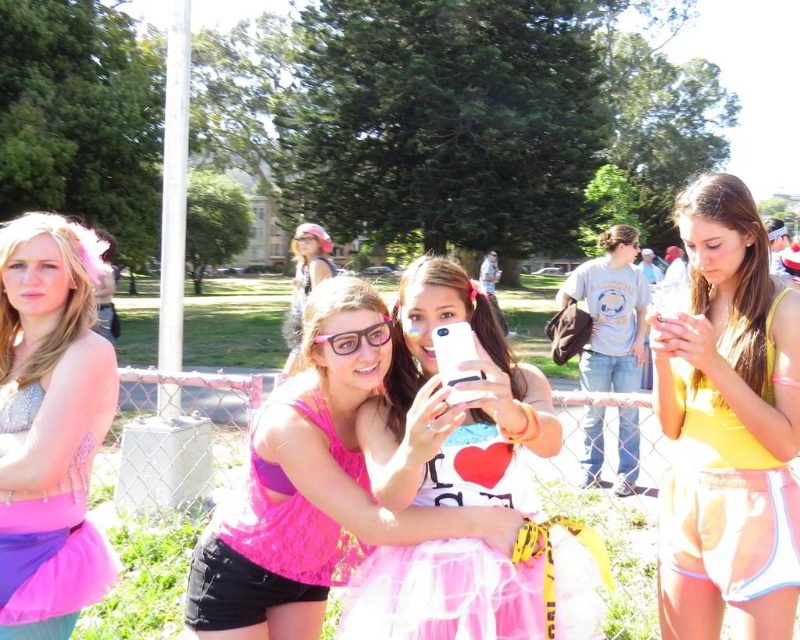
Question: Which object is closer to the camera taking this photo?

Choices:
 (A) pink tulle skirt at center
 (B) yellow fabric shorts at center
 (C) gray cotton t-shirt at center

Answer: (A)

Question: Estimate the real-world distances between objects in this image. Which object is farther from the white sheer fabric at lower right?

Choices:
 (A) sparkly silver dress at left
 (B) pink lace top at center
 (C) yellow fabric shorts at center

Answer: (A)

Question: Which point appears farthest from the camera in this image?

Choices:
 (A) (706, 436)
 (B) (272, 435)
 (C) (748, 488)
 (D) (90, 394)

Answer: (A)

Question: Can you confirm if pink tulle skirt at center is wider than white sheer fabric at lower right?

Choices:
 (A) yes
 (B) no

Answer: (A)

Question: Can you confirm if yellow fabric shorts at center is smaller than white sheer fabric at lower right?

Choices:
 (A) no
 (B) yes

Answer: (B)

Question: Where is pink lace top at center located in relation to white sheer fabric at lower right in the image?

Choices:
 (A) left
 (B) right

Answer: (A)